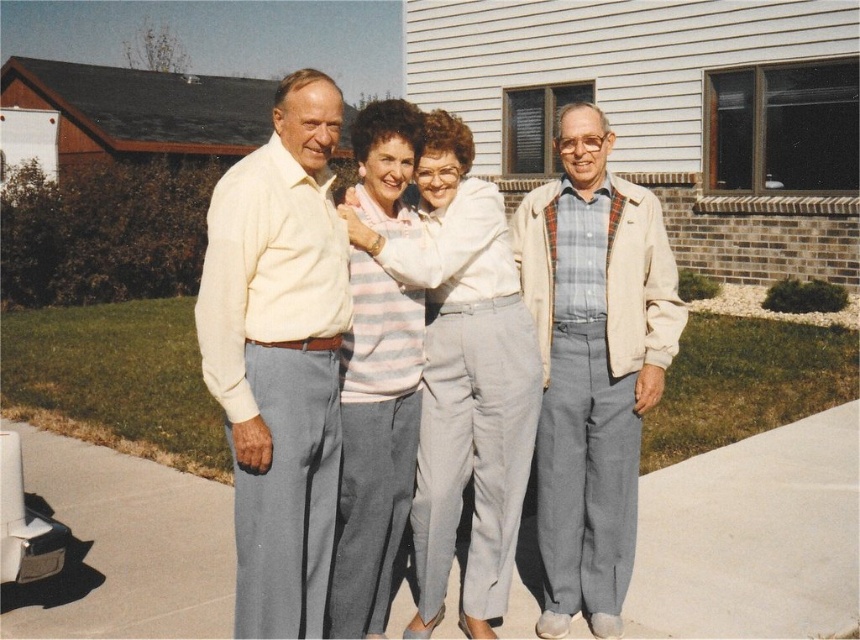
Question: Does light beige shirt at left come behind light beige jacket at right?

Choices:
 (A) yes
 (B) no

Answer: (B)

Question: Which of the following is the farthest from the observer?

Choices:
 (A) striped knit sweater at center
 (B) light gray pants at center

Answer: (A)

Question: Which object appears closest to the camera in this image?

Choices:
 (A) light beige shirt at left
 (B) light gray pants at center

Answer: (A)

Question: From the image, what is the correct spatial relationship of light beige shirt at left in relation to light beige jacket at right?

Choices:
 (A) above
 (B) below

Answer: (A)

Question: Which of the following is the farthest from the observer?

Choices:
 (A) (603, 316)
 (B) (410, 449)
 (C) (416, 564)

Answer: (C)

Question: Is light beige jacket at right to the right of striped knit sweater at center from the viewer's perspective?

Choices:
 (A) no
 (B) yes

Answer: (B)